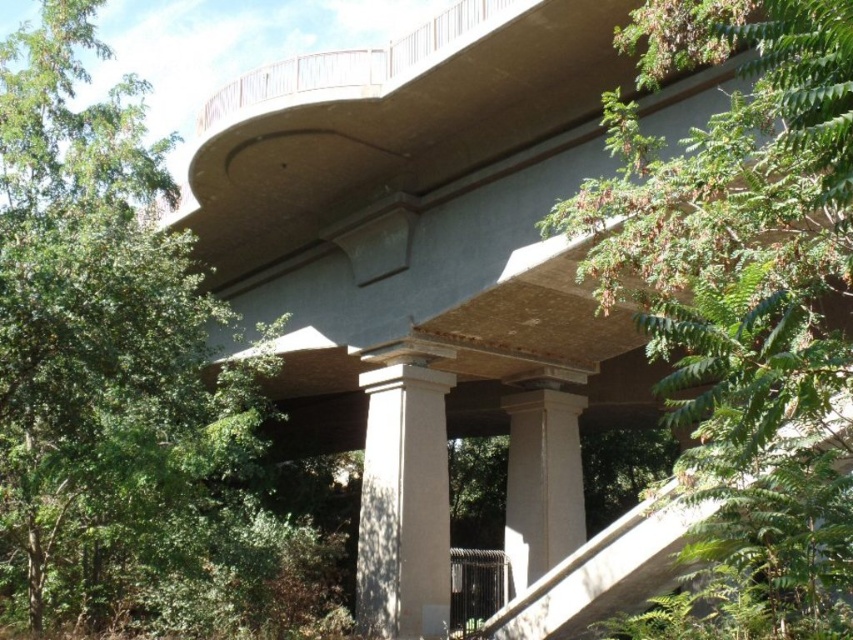
You are a maintenance worker standing on the bridge and need to inspect both the smooth concrete column at center and the white smooth column at center. If your ladder is 10 feet long, can you safely reach both columns from your current position?

The smooth concrete column at center is 9.40 feet away from the white smooth column at center. Since the ladder is 10 feet long, which is longer than the distance between them, you can safely reach both columns from your current position.

You are a delivery person carrying a heavy box and need to navigate the concrete stairs at center and the white smooth column at center. Which object should you avoid bumping into to prevent damaging the structure?

You should avoid bumping into the white smooth column at center because it is larger than the concrete stairs at center, making it more susceptible to damage from heavy impacts.

You are a maintenance worker needing to inspect the concrete stairs at center. The safety regulations require a minimum distance of 6 meters between inspection points to ensure safety. Can you safely proceed with the inspection given the current spacing?

The concrete stairs at center are 7.20 meters apart, which exceeds the required 6 meters. Therefore, you can safely proceed with the inspection.